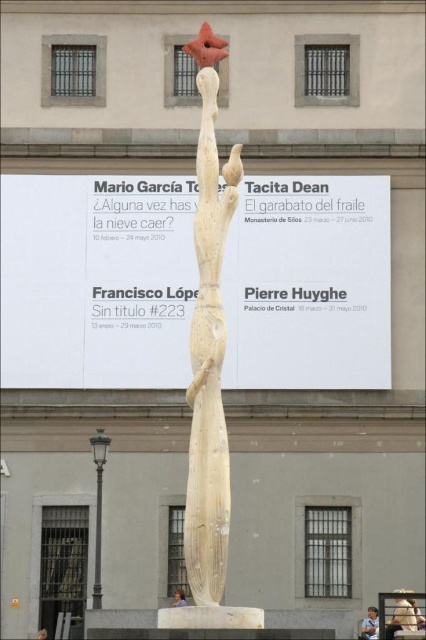
Question: Among these objects, which one is farthest from the camera?

Choices:
 (A) wooden statue at center
 (B) blonde hair at center

Answer: (B)

Question: Is wooden statue at center above blonde hair at center?

Choices:
 (A) no
 (B) yes

Answer: (B)

Question: In this image, where is wooden statue at center located relative to blonde hair at center?

Choices:
 (A) below
 (B) above

Answer: (B)

Question: Is the position of wooden statue at center less distant than that of light brown hair at center?

Choices:
 (A) yes
 (B) no

Answer: (A)

Question: Which point is farther from the camera taking this photo?

Choices:
 (A) tap(227, 195)
 (B) tap(373, 632)

Answer: (B)

Question: Estimate the real-world distances between objects in this image. Which object is farther from the blonde hair at center?

Choices:
 (A) wooden statue at center
 (B) light brown hair at center

Answer: (A)